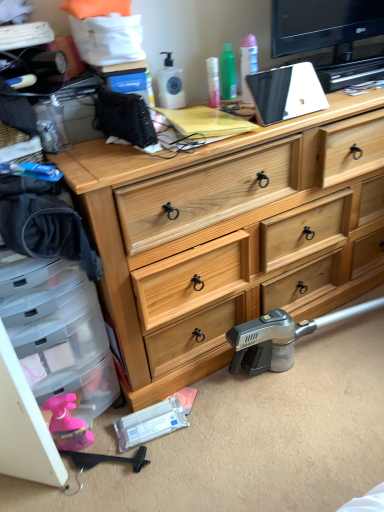
Where is `free space in front of black plastic hammer at lower left`? The height and width of the screenshot is (512, 384). free space in front of black plastic hammer at lower left is located at coordinates (113, 490).